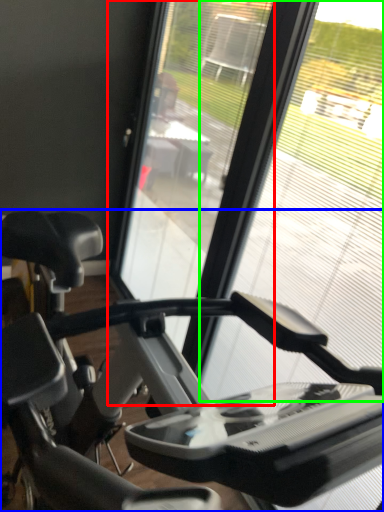
Question: Which object is positioned farthest from screen door (highlighted by a red box)? Select from stationary bicycle (highlighted by a blue box) and glass window (highlighted by a green box).

Choices:
 (A) stationary bicycle
 (B) glass window

Answer: (A)